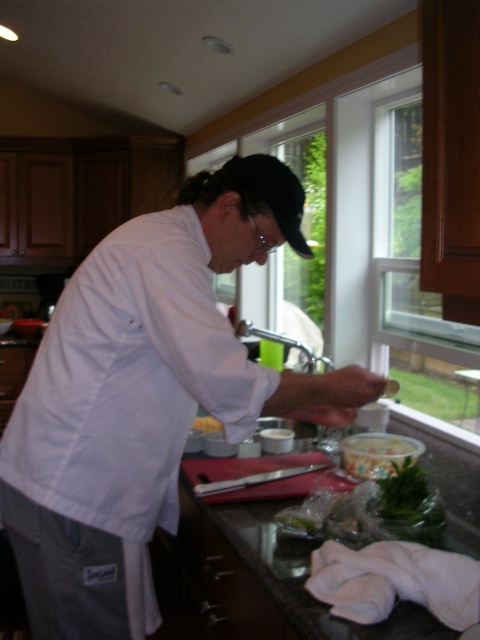
Question: Which point is closer to the camera?

Choices:
 (A) (195, 426)
 (B) (63, 364)
 (C) (416, 449)
 (D) (453, 474)

Answer: (B)

Question: Is smooth granite countertop at center further to camera compared to smooth plastic container at lower center?

Choices:
 (A) yes
 (B) no

Answer: (B)

Question: Which object is closer to the camera taking this photo?

Choices:
 (A) yellow matte butter at center
 (B) smooth granite countertop at center

Answer: (B)

Question: Is smooth granite countertop at center thinner than smooth plastic container at lower center?

Choices:
 (A) yes
 (B) no

Answer: (B)

Question: Among these objects, which one is nearest to the camera?

Choices:
 (A) smooth granite countertop at center
 (B) yellow matte butter at center
 (C) smooth plastic container at lower center
 (D) white fabric chef at center

Answer: (A)

Question: Can you confirm if white fabric chef at center is positioned to the left of smooth granite countertop at center?

Choices:
 (A) yes
 (B) no

Answer: (A)